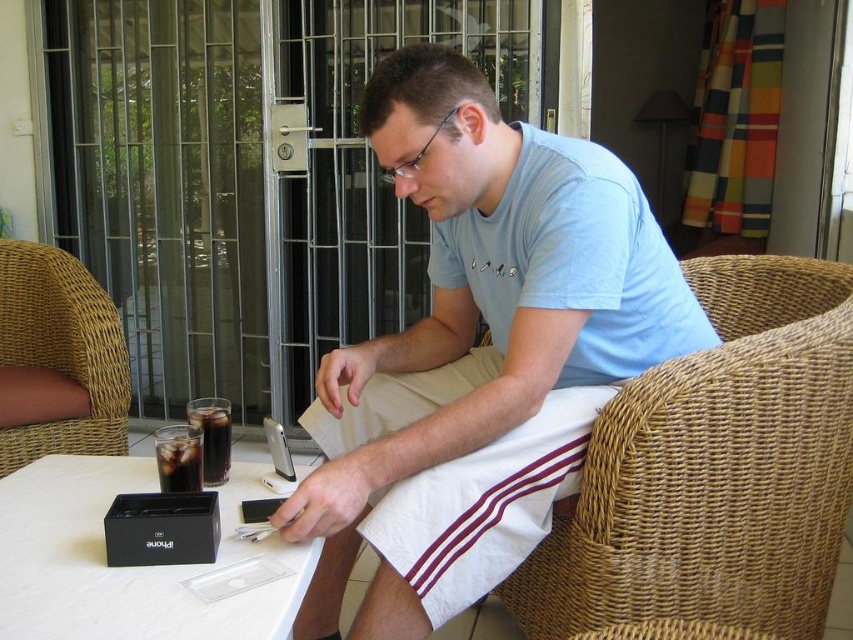
Question: Is brown wicker chair at left closer to the viewer compared to dark glass beverage at table left?

Choices:
 (A) yes
 (B) no

Answer: (B)

Question: Based on their relative distances, which object is nearer to the dark glass beverage at table left?

Choices:
 (A) brown wicker chair at left
 (B) light blue t-shirt at center

Answer: (B)

Question: Is light blue t-shirt at center wider than dark glass beverage at table left?

Choices:
 (A) no
 (B) yes

Answer: (B)

Question: Which point is farther to the camera?

Choices:
 (A) (260, 474)
 (B) (700, 371)
 (C) (184, 436)

Answer: (A)

Question: Does light blue t-shirt at center have a greater width compared to brown wicker chair at left?

Choices:
 (A) no
 (B) yes

Answer: (B)

Question: Among these objects, which one is nearest to the camera?

Choices:
 (A) black plastic table at lower left
 (B) dark glass beverage at table left
 (C) brown wicker chair at left
 (D) woven brown chair at right

Answer: (A)